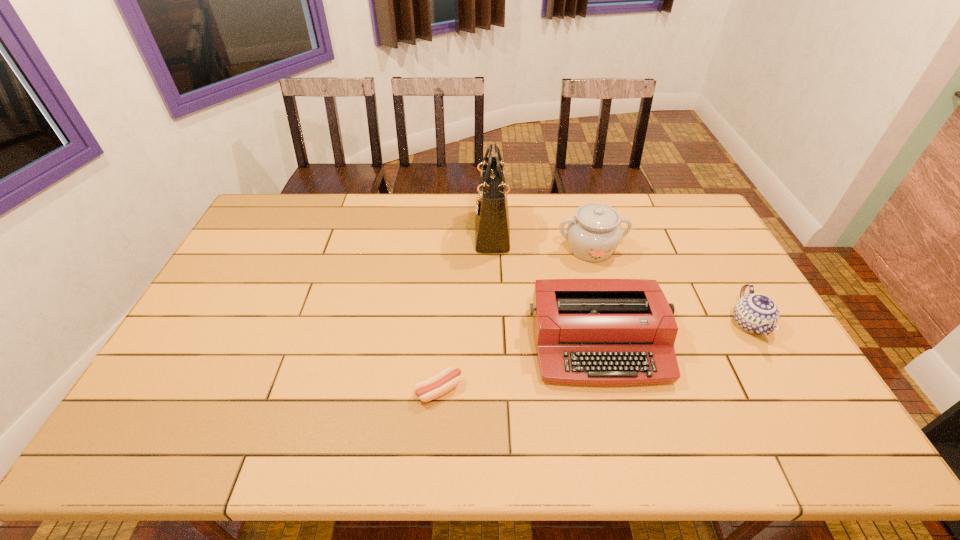
Locate an element on the screen. This screenshot has height=540, width=960. vacant space at the right edge is located at coordinates (707, 243).

The image size is (960, 540). What are the coordinates of `free space at the far right corner of the desktop` in the screenshot? It's located at (681, 232).

Where is `free spot between the shortest object and the second object from left to right`? This screenshot has height=540, width=960. free spot between the shortest object and the second object from left to right is located at coordinates (x=466, y=310).

The image size is (960, 540). What are the coordinates of `free spot between the sausage and the second object from left to right` in the screenshot? It's located at (466, 310).

Where is `unoccupied position between the sausage and the taller chinaware`? This screenshot has width=960, height=540. unoccupied position between the sausage and the taller chinaware is located at coordinates (515, 320).

Image resolution: width=960 pixels, height=540 pixels. What are the coordinates of `vacant space that is in between the second object from left to right and the shorter chinaware` in the screenshot? It's located at (621, 278).

The width and height of the screenshot is (960, 540). I want to click on free space between the handbag and the shortest object, so click(466, 310).

Where is `free space between the typewriter and the leftmost object`? This screenshot has height=540, width=960. free space between the typewriter and the leftmost object is located at coordinates (518, 367).

Choose which object is the fourth nearest neighbor to the farther chinaware. Please provide its 2D coordinates. Your answer should be formatted as a tuple, i.e. [(x, y)], where the tuple contains the x and y coordinates of a point satisfying the conditions above.

[(432, 388)]

Select which object appears as the closest to the nearer chinaware. Please provide its 2D coordinates. Your answer should be formatted as a tuple, i.e. [(x, y)], where the tuple contains the x and y coordinates of a point satisfying the conditions above.

[(609, 332)]